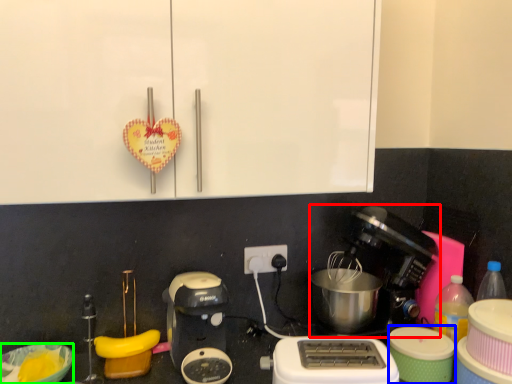
Question: Which object is positioned closest to coffee maker (highlighted by a red box)? Select from appliance (highlighted by a blue box) and bowl (highlighted by a green box).

Choices:
 (A) appliance
 (B) bowl

Answer: (A)